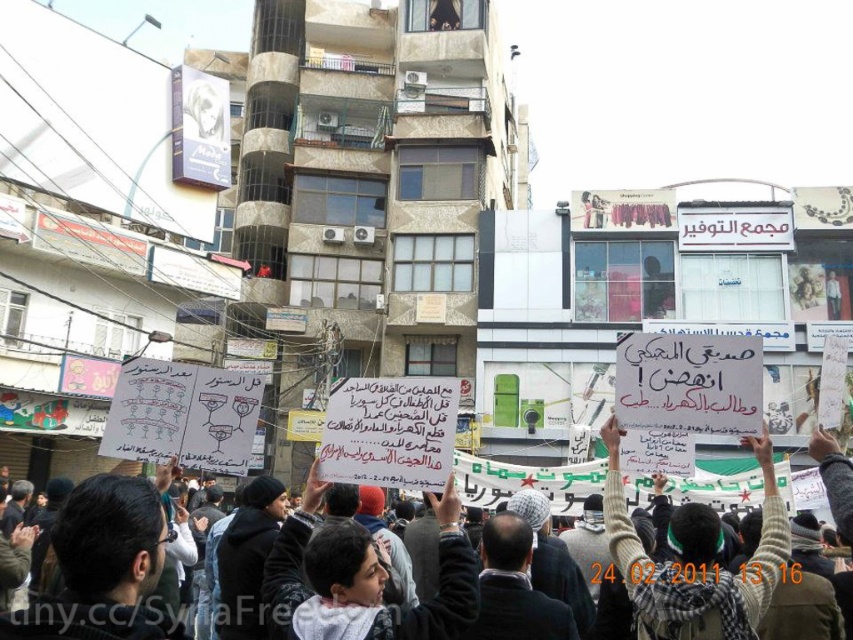
Which is above, white paper sign at center or white knitted sweater at center?

white knitted sweater at center is above.

Consider the image. Is white paper sign at center in front of white knitted sweater at center?

Yes, white paper sign at center is in front of white knitted sweater at center.

Describe the element at coordinates (695, 556) in the screenshot. The image size is (853, 640). I see `white paper sign at center` at that location.

The width and height of the screenshot is (853, 640). What are the coordinates of `white paper sign at center` in the screenshot? It's located at (695, 556).